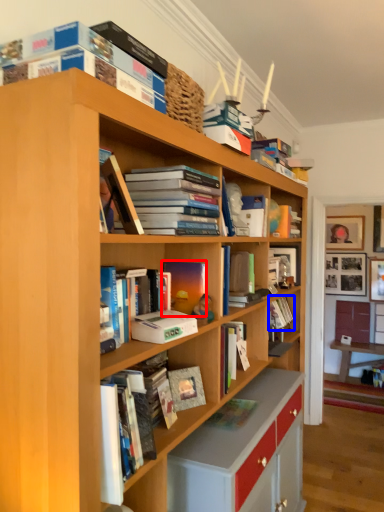
Question: Which object appears closest to the camera in this image, book (highlighted by a red box) or book (highlighted by a blue box)?

Choices:
 (A) book
 (B) book

Answer: (A)